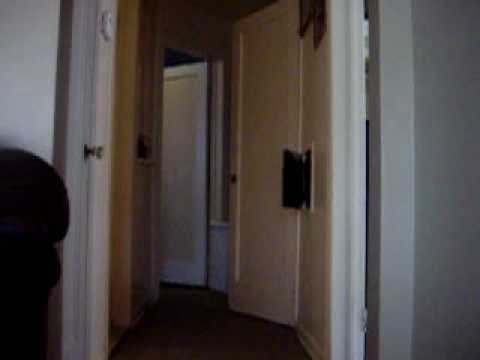
Find the location of a particular element. floor is located at coordinates (192, 334).